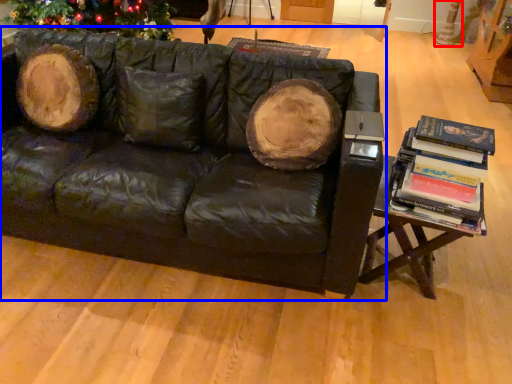
Question: Which object appears farthest to the camera in this image, tree trunk (highlighted by a red box) or studio couch (highlighted by a blue box)?

Choices:
 (A) tree trunk
 (B) studio couch

Answer: (A)